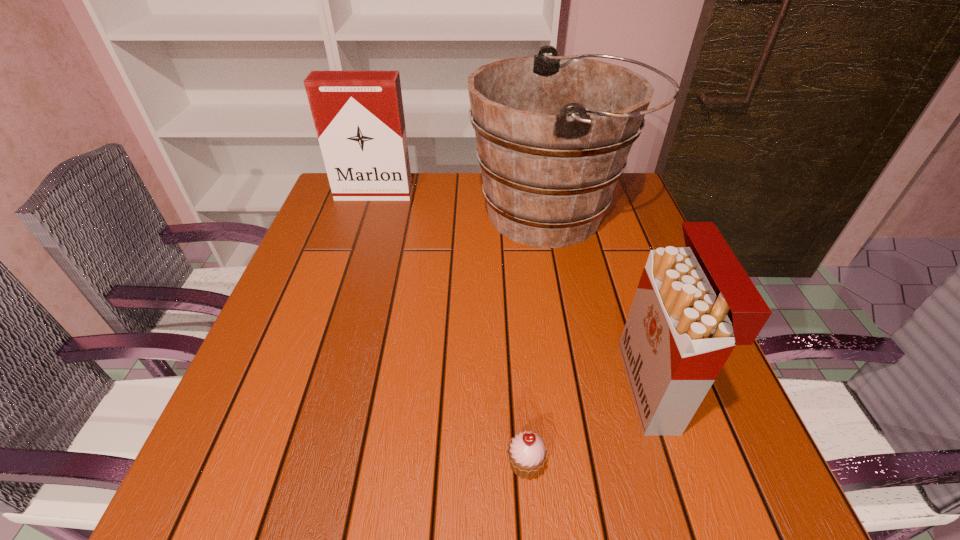
At what (x,y) coordinates should I click in order to perform the action: click on vacant position located 0.190m with the lid open on the nearer cigarette case. Please return your answer as a coordinate pair (x, y). This screenshot has width=960, height=540. Looking at the image, I should click on (526, 387).

Where is `free space located 0.320m on the left of the shortest object`? This screenshot has width=960, height=540. free space located 0.320m on the left of the shortest object is located at coordinates (304, 464).

Find the location of a particular element. The height and width of the screenshot is (540, 960). bucket at the far edge is located at coordinates (553, 133).

I want to click on cigarette_case that is at the far edge, so click(x=359, y=118).

Locate an element on the screen. The width and height of the screenshot is (960, 540). object that is positioned at the near edge is located at coordinates (526, 452).

At what (x,y) coordinates should I click in order to perform the action: click on object at the left edge. Please return your answer as a coordinate pair (x, y). Looking at the image, I should click on (359, 118).

Image resolution: width=960 pixels, height=540 pixels. What are the coordinates of `bucket located at the right edge` in the screenshot? It's located at (553, 133).

You are a GUI agent. You are given a task and a screenshot of the screen. Output one action in this format:
    pyautogui.click(x=<x>, y=<y>)
    Task: Click on the cigarette case present at the right edge
    Image resolution: width=960 pixels, height=540 pixels.
    Given the screenshot: What is the action you would take?
    pyautogui.click(x=694, y=304)

I want to click on object located at the far left corner, so click(359, 118).

You are a GUI agent. You are given a task and a screenshot of the screen. Output one action in this format:
    pyautogui.click(x=<x>, y=<y>)
    Task: Click on the object that is at the far right corner
    This screenshot has height=540, width=960.
    Given the screenshot: What is the action you would take?
    pyautogui.click(x=553, y=133)